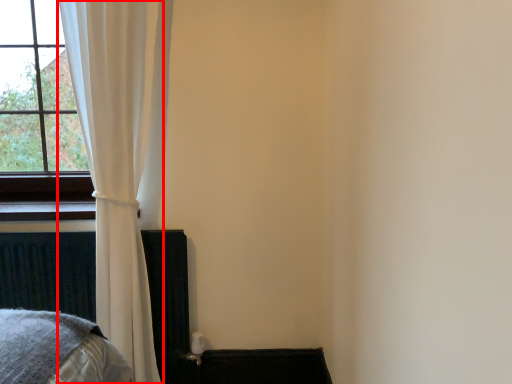
Question: From the image's perspective, considering the relative positions of curtain (annotated by the red box) and bed frame in the image provided, where is curtain (annotated by the red box) located with respect to the staircase?

Choices:
 (A) above
 (B) below

Answer: (A)